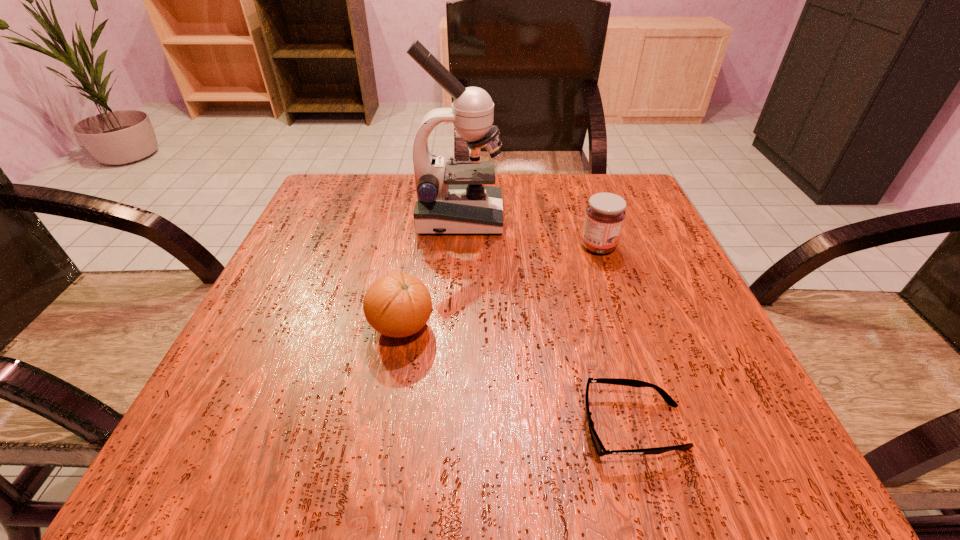
In the image, there is a desktop. Identify the location of free space at the far left corner. 329,173.

I want to click on vacant point at the near left corner, so click(268, 476).

This screenshot has height=540, width=960. What are the coordinates of `free space at the far right corner of the desktop` in the screenshot? It's located at (577, 199).

Find the location of `free space at the near right corner of the desktop`. free space at the near right corner of the desktop is located at coordinates pyautogui.click(x=746, y=436).

This screenshot has height=540, width=960. What are the coordinates of `vacant area between the microscope and the jam` in the screenshot? It's located at (529, 232).

The width and height of the screenshot is (960, 540). What are the coordinates of `vacant space that is in between the third farthest object and the jam` in the screenshot? It's located at (500, 287).

Where is `free space between the jam and the orange`? This screenshot has height=540, width=960. free space between the jam and the orange is located at coordinates (500, 287).

Find the location of a particular element. The image size is (960, 540). vacant space that is in between the third farthest object and the nearest object is located at coordinates (518, 377).

Locate an element on the screen. vacant space that's between the orange and the tallest object is located at coordinates (431, 273).

Identify the location of free spot between the microscope and the jam. click(529, 232).